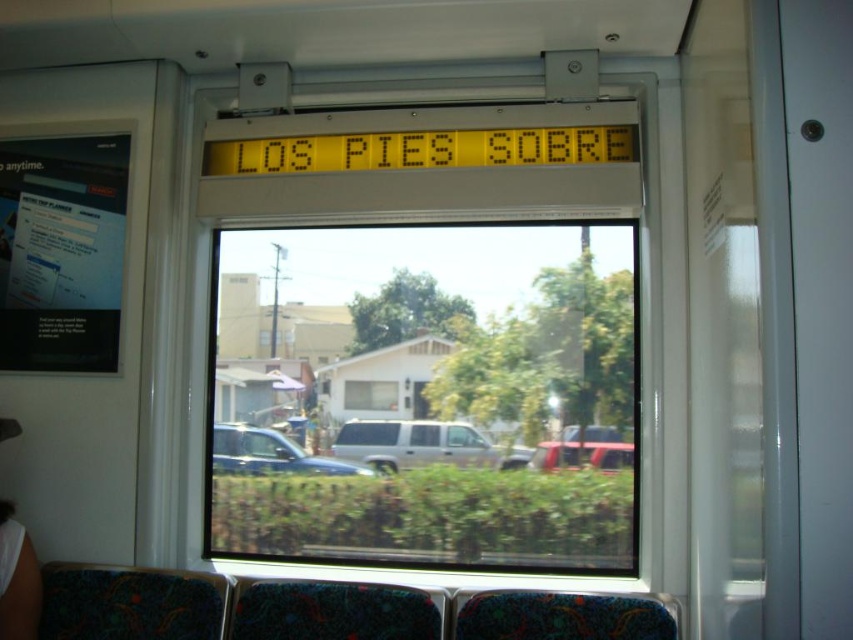
You are a passenger on a bus and want to look at the silver metallic suv at center outside. Where should you stand relative to the clear glass window at center to see it best?

To best see the silver metallic suv at center, you should stand to the right of the clear glass window at center because the window is positioned to the left of the suv.

You are a passenger sitting in the middle of the bus and looking out the window. You notice two cars outside. Which car is closer to the left side of the window? The metallic silver car at center or the metallic red car at center?

The metallic silver car at center is to the left of the metallic red car at center, so the metallic silver car at center is closer to the left side of the window.

You are inside the vehicle and looking out the window. There is a point marked at coordinates (270,452) on the window. What object is located at that point?

The point at (270,452) corresponds to the metallic silver car at center.